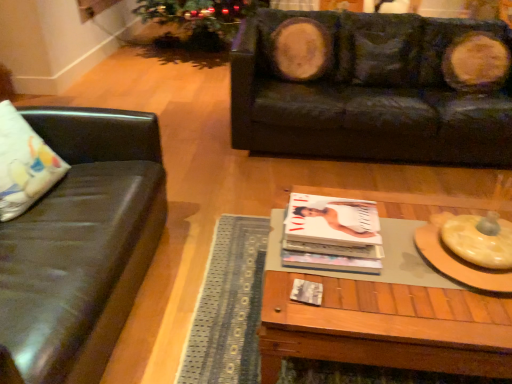
Where is `free location to the right of matte black couch at left, the 1th studio couch in the front-to-back sequence`? free location to the right of matte black couch at left, the 1th studio couch in the front-to-back sequence is located at coordinates (208, 288).